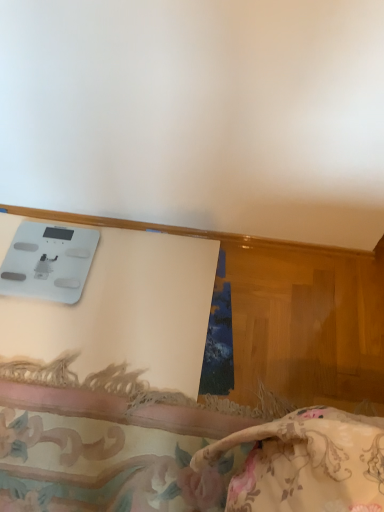
In order to face white glossy scale at upper left, should I rotate leftwards or rightwards?

Turn left by 14.500 degrees to look at white glossy scale at upper left.

You are a GUI agent. You are given a task and a screenshot of the screen. Output one action in this format:
    pyautogui.click(x=<x>, y=<y>)
    Task: Click on the white wood trim at upper center
    The image size is (384, 512).
    Given the screenshot: What is the action you would take?
    pyautogui.click(x=199, y=233)

From the picture: From a real-world perspective, relative to white wood trim at upper center, is white glossy scale at upper left vertically above or below?

In terms of real-world spatial position, white glossy scale at upper left is below white wood trim at upper center.

You are a GUI agent. You are given a task and a screenshot of the screen. Output one action in this format:
    pyautogui.click(x=<x>, y=<y>)
    Task: Click on the table below the white wood trim at upper center (from the image's perspective)
    This screenshot has width=384, height=512.
    Given the screenshot: What is the action you would take?
    pyautogui.click(x=126, y=311)

How many degrees apart are the facing directions of white glossy scale at upper left and white wood trim at upper center?

white glossy scale at upper left and white wood trim at upper center are facing 0.348 degrees away from each other.

Which object is positioned more to the left, white wood trim at upper center or white glossy scale at upper left?

white glossy scale at upper left is more to the left.

What's the angular difference between white wood trim at upper center and white glossy scale at upper left's facing directions?

The angle between the facing direction of white wood trim at upper center and the facing direction of white glossy scale at upper left is 0.348 degrees.

Is white glossy scale at upper left a part of white wood trim at upper center?

No, white glossy scale at upper left is not a part of white wood trim at upper center.

Relative to white glossy scale at upper left, is white wood trim at upper center in front or behind?

Visually, white wood trim at upper center is located behind white glossy scale at upper left.

Is floral fabric cushion at lower center at the left side of white wood trim at upper center?

Yes.

From the image's perspective, which object appears higher, floral fabric cushion at lower center or white wood trim at upper center?

white wood trim at upper center is shown above in the image.

Is floral fabric cushion at lower center positioned with its back to white wood trim at upper center?

floral fabric cushion at lower center is not turned away from white wood trim at upper center.

Are floral fabric cushion at lower center and white wood trim at upper center beside each other?

No, floral fabric cushion at lower center is not making contact with white wood trim at upper center.

Is there a large distance between white glossy scale at upper left and floral fabric cushion at lower center?

No, white glossy scale at upper left is not far from floral fabric cushion at lower center.

In terms of width, does white glossy scale at upper left look wider or thinner when compared to floral fabric cushion at lower center?

Considering their sizes, white glossy scale at upper left looks broader than floral fabric cushion at lower center.

Consider the image. Can you tell me how much white glossy scale at upper left and floral fabric cushion at lower center differ in facing direction?

180 degrees.

From a real-world perspective, is white glossy scale at upper left beneath floral fabric cushion at lower center?

No, from a real-world perspective, white glossy scale at upper left is not beneath floral fabric cushion at lower center.

Looking at this image, from a real-world perspective, is white wood trim at upper center on floral fabric cushion at lower center?

Yes, from a real-world perspective, white wood trim at upper center is over floral fabric cushion at lower center

Can you tell me how much white wood trim at upper center and floral fabric cushion at lower center differ in facing direction?

They differ by 180 degrees in their facing directions.

Between white wood trim at upper center and floral fabric cushion at lower center, which one is positioned in front?

floral fabric cushion at lower center is closer to the camera.

Which is in front, point (295, 248) or point (96, 482)?

The point (96, 482) is in front.

Consider the image. Is floral fabric cushion at lower center not near white glossy scale at upper left?

No.

Can you confirm if floral fabric cushion at lower center is smaller than white glossy scale at upper left?

Yes, floral fabric cushion at lower center is smaller than white glossy scale at upper left.

Can you tell me how much floral fabric cushion at lower center and white glossy scale at upper left differ in facing direction?

The angle between the facing direction of floral fabric cushion at lower center and the facing direction of white glossy scale at upper left is 180 degrees.

Locate an element on the screen. The height and width of the screenshot is (512, 384). table directly beneath the white wood trim at upper center (from a real-world perspective) is located at coordinates (126, 311).

In order to click on trim behind the white glossy scale at upper left in this screenshot , I will do `click(199, 233)`.

Looking at the image, which one is located closer to floral fabric cushion at lower center, white wood trim at upper center or white glossy scale at upper left?

white glossy scale at upper left is closer to floral fabric cushion at lower center.

Looking at the image, which one is located closer to floral fabric cushion at lower center, white glossy scale at upper left or white wood trim at upper center?

white glossy scale at upper left is closer to floral fabric cushion at lower center.

Considering their positions, is floral fabric cushion at lower center positioned closer to white wood trim at upper center than white glossy scale at upper left?

Based on the image, white glossy scale at upper left appears to be nearer to white wood trim at upper center.

Considering their positions, is floral fabric cushion at lower center positioned further to white glossy scale at upper left than white wood trim at upper center?

The object further to white glossy scale at upper left is white wood trim at upper center.

From the image, which object appears to be farther from white wood trim at upper center, white glossy scale at upper left or floral fabric cushion at lower center?

floral fabric cushion at lower center is positioned further to the anchor white wood trim at upper center.

Which object lies further to the anchor point white glossy scale at upper left, white wood trim at upper center or floral fabric cushion at lower center?

The object further to white glossy scale at upper left is white wood trim at upper center.

This screenshot has height=512, width=384. What are the coordinates of `table that lies between white wood trim at upper center and floral fabric cushion at lower center from top to bottom` in the screenshot? It's located at (126, 311).